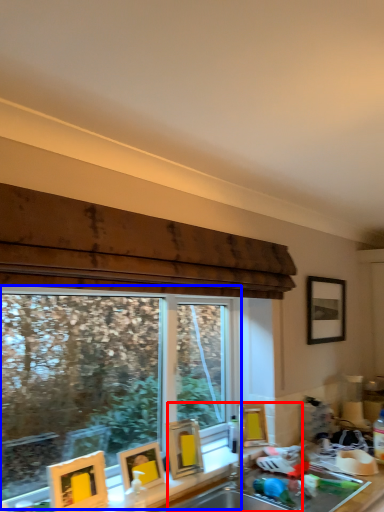
Question: Which of the following is the closest to the observer, sink (highlighted by a red box) or window (highlighted by a blue box)?

Choices:
 (A) sink
 (B) window

Answer: (B)